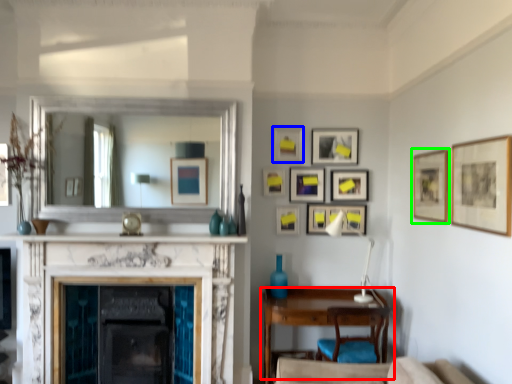
Question: Which object is the farthest from table (highlighted by a red box)? Choose among these: picture frame (highlighted by a blue box) or picture frame (highlighted by a green box).

Choices:
 (A) picture frame
 (B) picture frame

Answer: (A)